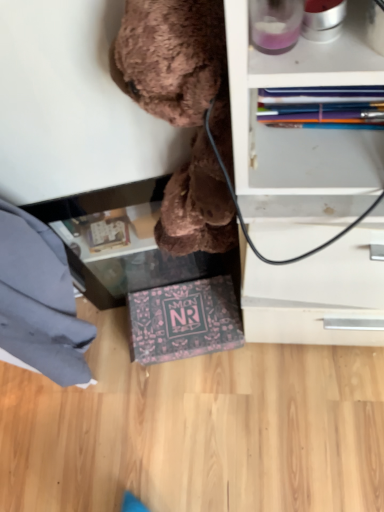
Question: Does dark blue fabric at lower left appear on the right side of transparent glass table at lower center?

Choices:
 (A) no
 (B) yes

Answer: (A)

Question: Does dark blue fabric at lower left have a greater width compared to transparent glass table at lower center?

Choices:
 (A) yes
 (B) no

Answer: (A)

Question: Is dark blue fabric at lower left not within transparent glass table at lower center?

Choices:
 (A) no
 (B) yes

Answer: (B)

Question: Is dark blue fabric at lower left beside transparent glass table at lower center?

Choices:
 (A) no
 (B) yes

Answer: (A)

Question: From a real-world perspective, is dark blue fabric at lower left under transparent glass table at lower center?

Choices:
 (A) yes
 (B) no

Answer: (B)

Question: Is the position of dark blue fabric at lower left less distant than that of transparent glass table at lower center?

Choices:
 (A) no
 (B) yes

Answer: (B)

Question: Could you tell me if dark blue fabric at lower left is turned towards brown plush toy at upper center?

Choices:
 (A) yes
 (B) no

Answer: (B)

Question: Considering the relative positions of dark blue fabric at lower left and brown plush toy at upper center in the image provided, is dark blue fabric at lower left to the left of brown plush toy at upper center from the viewer's perspective?

Choices:
 (A) no
 (B) yes

Answer: (B)

Question: Is dark blue fabric at lower left turned away from brown plush toy at upper center?

Choices:
 (A) no
 (B) yes

Answer: (A)

Question: Does dark blue fabric at lower left touch brown plush toy at upper center?

Choices:
 (A) yes
 (B) no

Answer: (B)

Question: Is dark blue fabric at lower left smaller than brown plush toy at upper center?

Choices:
 (A) yes
 (B) no

Answer: (B)

Question: From a real-world perspective, is dark blue fabric at lower left positioned over brown plush toy at upper center based on gravity?

Choices:
 (A) no
 (B) yes

Answer: (A)

Question: Are transparent glass table at lower center and brown plush toy at upper center located far from each other?

Choices:
 (A) no
 (B) yes

Answer: (A)